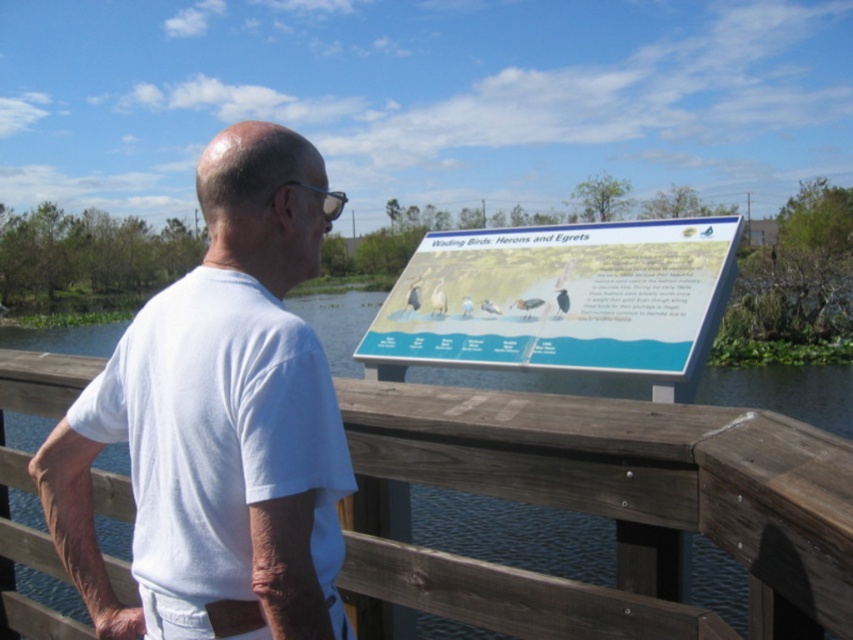
Question: Among these objects, which one is farthest from the camera?

Choices:
 (A) blue glossy signboard at center
 (B) white cotton shirt at center

Answer: (A)

Question: Which object is farther from the camera taking this photo?

Choices:
 (A) white cotton shirt at center
 (B) blue glossy signboard at center

Answer: (B)

Question: Is white cotton shirt at center to the left of blue glossy signboard at center from the viewer's perspective?

Choices:
 (A) no
 (B) yes

Answer: (B)

Question: Considering the relative positions of white cotton shirt at center and blue glossy signboard at center in the image provided, where is white cotton shirt at center located with respect to blue glossy signboard at center?

Choices:
 (A) below
 (B) above

Answer: (A)

Question: Does white cotton shirt at center appear under blue glossy signboard at center?

Choices:
 (A) yes
 (B) no

Answer: (A)

Question: Which point is closer to the camera taking this photo?

Choices:
 (A) pyautogui.click(x=271, y=529)
 (B) pyautogui.click(x=389, y=321)

Answer: (A)